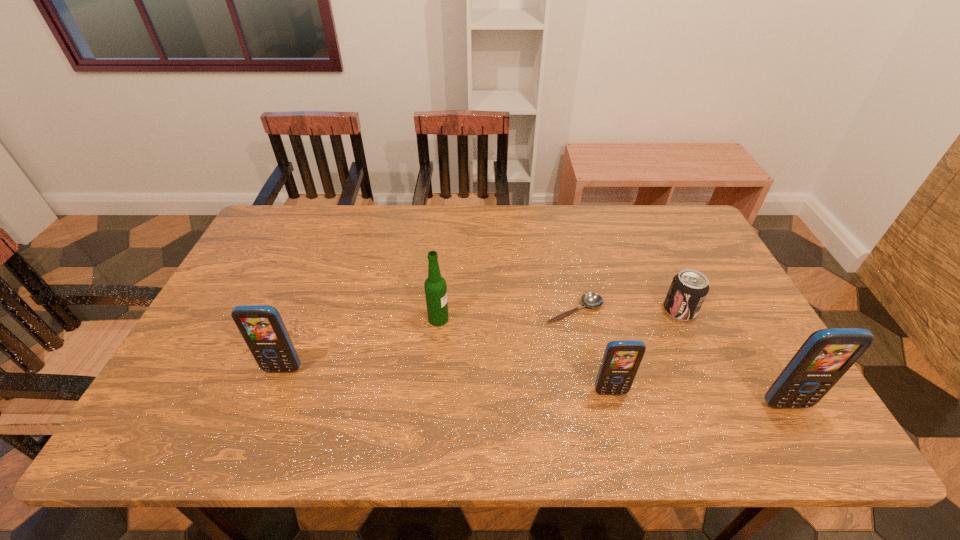
To make them evenly spaced by inserting another cellular_telephone among them, please locate a free space for this new cellular_telephone. Please provide its 2D coordinates. Your answer should be formatted as a tuple, i.e. [(x, y)], where the tuple contains the x and y coordinates of a point satisfying the conditions above.

[(443, 381)]